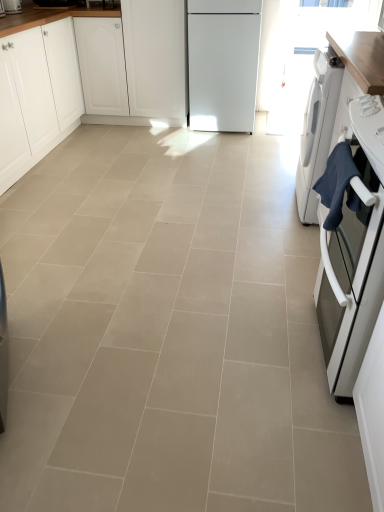
Question: Considering the positions of matte white toaster at upper left and beige ceramic tile at center in the image, is matte white toaster at upper left taller or shorter than beige ceramic tile at center?

Choices:
 (A) short
 (B) tall

Answer: (B)

Question: From a real-world perspective, is matte white toaster at upper left above or below beige ceramic tile at center?

Choices:
 (A) below
 (B) above

Answer: (B)

Question: Estimate the real-world distances between objects in this image. Which object is farther from the matte white toaster at upper left?

Choices:
 (A) white matte cabinet at center, placed as the 2th cabinetry when sorted from left to right
 (B) white glossy oven at right, marked as the 1th home appliance in a front-to-back arrangement
 (C) white matte cabinet at left, placed as the 2th cabinetry when sorted from right to left
 (D) white glossy washing machine at right, which is counted as the first home appliance, starting from the back
 (E) beige ceramic tile at center

Answer: (B)

Question: Which of these objects is positioned closest to the white glossy oven at right, marked as the 1th home appliance in a front-to-back arrangement?

Choices:
 (A) matte white toaster at upper left
 (B) white glossy washing machine at right, which is counted as the first home appliance, starting from the back
 (C) beige ceramic tile at center
 (D) white matte cabinet at left, placed as the 2th cabinetry when sorted from right to left
 (E) white matte cabinet at center, placed as the 2th cabinetry when sorted from left to right

Answer: (C)